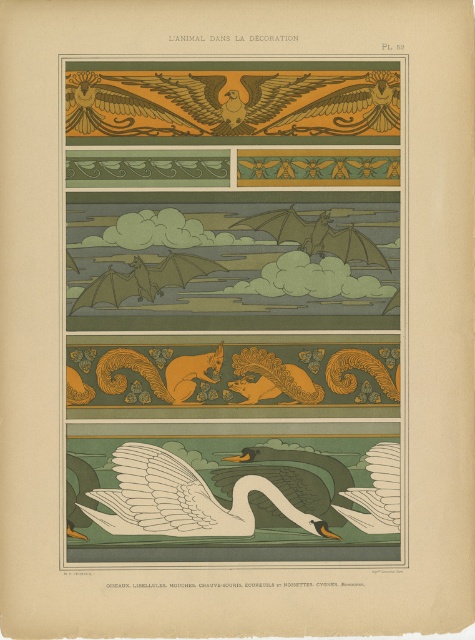
Question: Which point is closer to the camera?

Choices:
 (A) white matte swan at bottom center
 (B) gold metallic eagle at upper center

Answer: (A)

Question: Which point appears closest to the camera in this image?

Choices:
 (A) (244, 522)
 (B) (151, 72)

Answer: (B)

Question: Which is farther from the gold metallic eagle at upper center?

Choices:
 (A) matte gold eagle at upper center
 (B) white matte swan at bottom center

Answer: (B)

Question: Is matte gold eagle at upper center wider than gold metallic eagle at upper center?

Choices:
 (A) no
 (B) yes

Answer: (B)

Question: Can you confirm if matte gold eagle at upper center is positioned to the left of white matte swan at bottom center?

Choices:
 (A) no
 (B) yes

Answer: (A)

Question: Is matte gold eagle at upper center to the left of white matte swan at bottom center from the viewer's perspective?

Choices:
 (A) no
 (B) yes

Answer: (A)